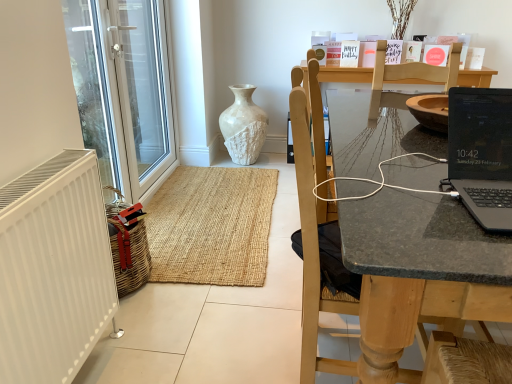
Question: Is wooden chair at right outside white textured vase at center?

Choices:
 (A) no
 (B) yes

Answer: (B)

Question: Is the depth of wooden chair at right greater than that of white textured vase at center?

Choices:
 (A) no
 (B) yes

Answer: (A)

Question: From a real-world perspective, is wooden chair at right below white textured vase at center?

Choices:
 (A) yes
 (B) no

Answer: (B)

Question: From a real-world perspective, is wooden chair at right physically above white textured vase at center?

Choices:
 (A) yes
 (B) no

Answer: (A)

Question: From the image's perspective, does wooden chair at right appear higher than white textured vase at center?

Choices:
 (A) no
 (B) yes

Answer: (A)

Question: Can you confirm if wooden chair at right is shorter than white textured vase at center?

Choices:
 (A) yes
 (B) no

Answer: (B)

Question: Considering the relative sizes of transparent glass door at left and white matte radiator at left in the image provided, is transparent glass door at left smaller than white matte radiator at left?

Choices:
 (A) yes
 (B) no

Answer: (B)

Question: From the image's perspective, is transparent glass door at left located beneath white matte radiator at left?

Choices:
 (A) yes
 (B) no

Answer: (B)

Question: Is transparent glass door at left aimed at white matte radiator at left?

Choices:
 (A) yes
 (B) no

Answer: (B)

Question: Is transparent glass door at left not near white matte radiator at left?

Choices:
 (A) no
 (B) yes

Answer: (B)

Question: Can we say transparent glass door at left lies outside white matte radiator at left?

Choices:
 (A) yes
 (B) no

Answer: (A)

Question: Is the position of transparent glass door at left less distant than that of white matte radiator at left?

Choices:
 (A) yes
 (B) no

Answer: (B)

Question: Are black glossy laptop at right and white matte radiator at left far apart?

Choices:
 (A) no
 (B) yes

Answer: (B)